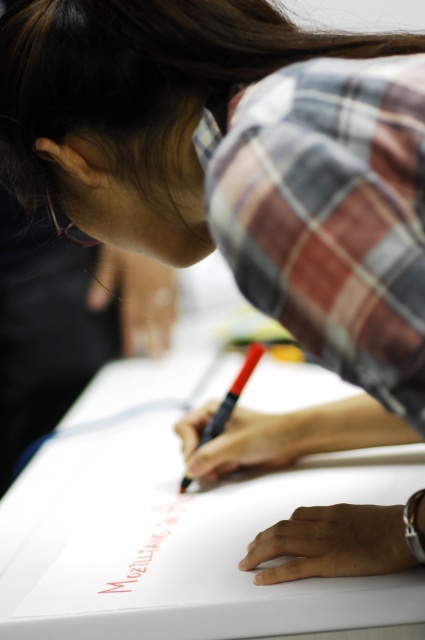
You are an artist who needs to know the proportions of the objects in the scene. Which object, the white paper at center or the black matte pen at center, is taller?

The white paper at center is much taller than the black matte pen at center.

You are an observer looking at the scene. The white paper at center and the black matte pen at center are both in the center of the image. Which object is closer to the bottom edge of the image?

The white paper at center is located below the black matte pen at center, so it is closer to the bottom edge of the image.